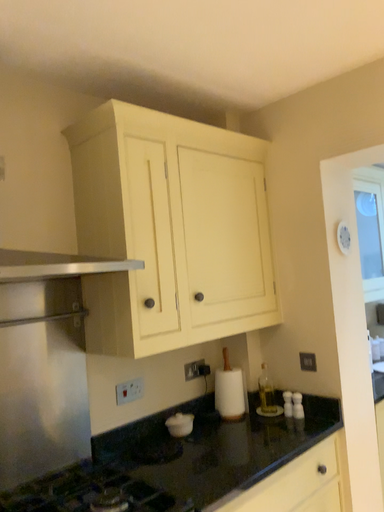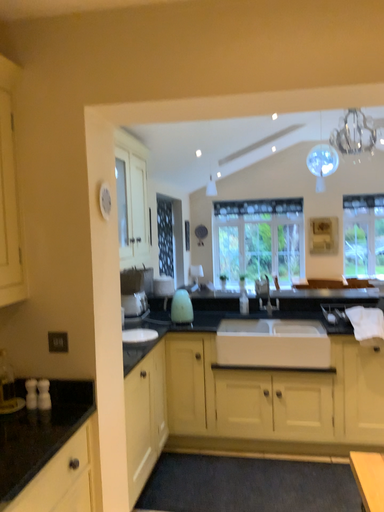
Question: How did the camera likely rotate when shooting the video?

Choices:
 (A) rotated right
 (B) rotated left

Answer: (A)